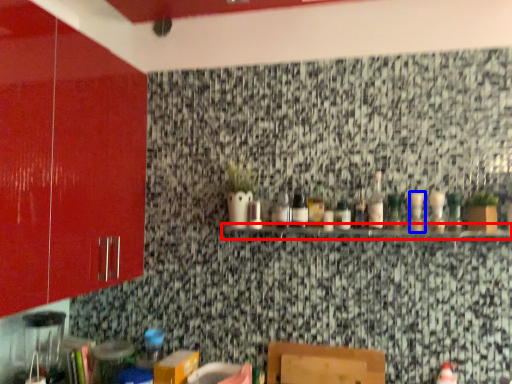
Question: Among these objects, which one is farthest to the camera, shelf (highlighted by a red box) or bottle (highlighted by a blue box)?

Choices:
 (A) shelf
 (B) bottle

Answer: (B)